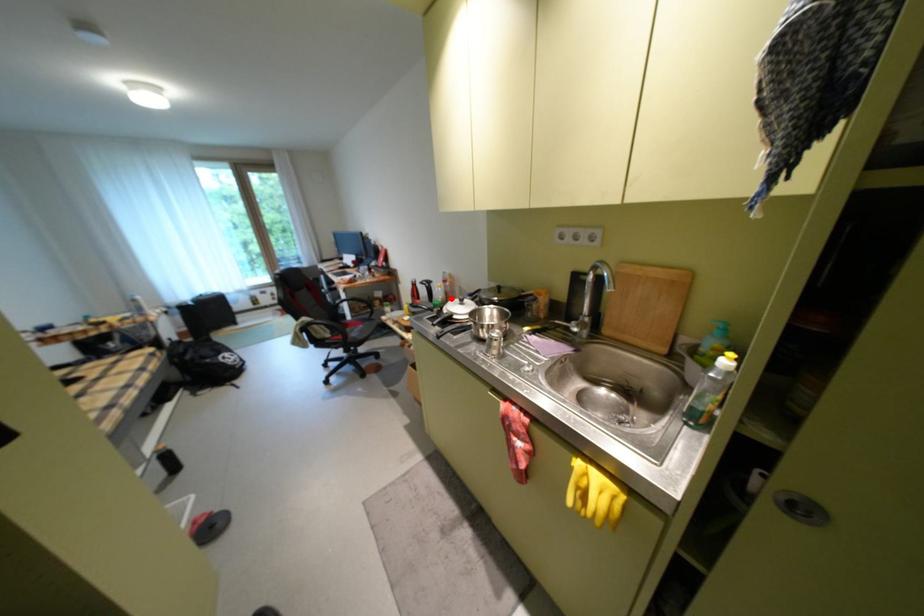
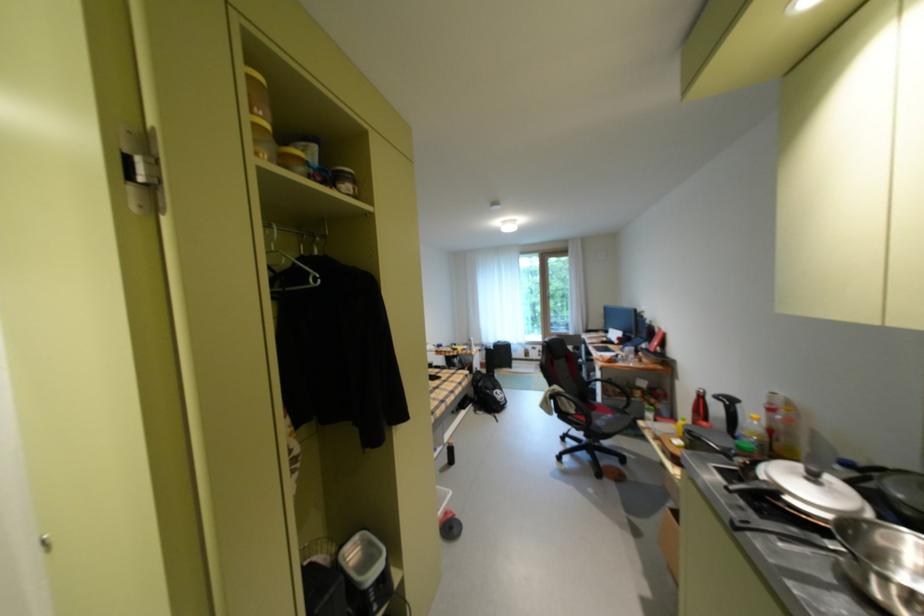
In the second image, find the point that corresponds to the highlighted location in the first image.

(766, 439)